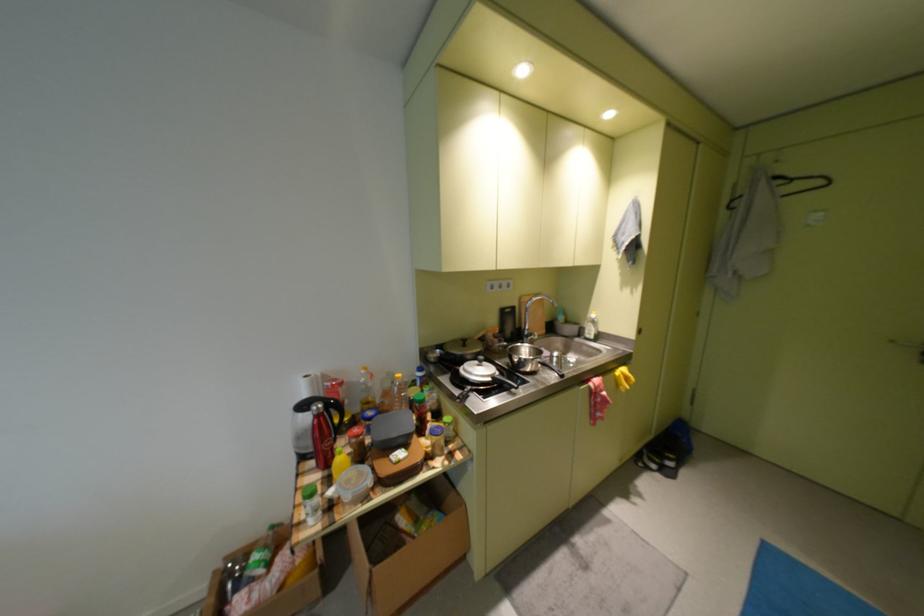
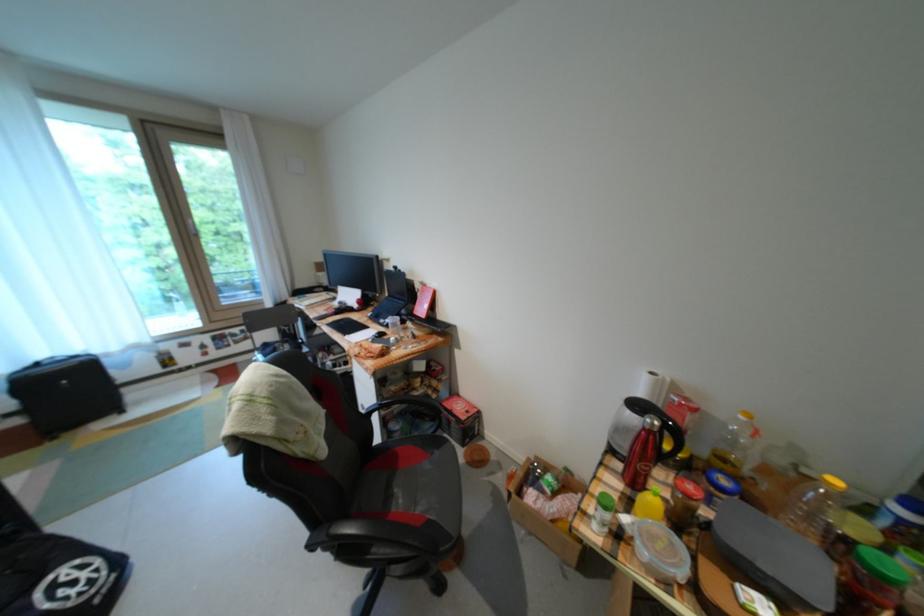
Find the pixel in the second image that matches the point at 336,474 in the first image.

(639, 493)